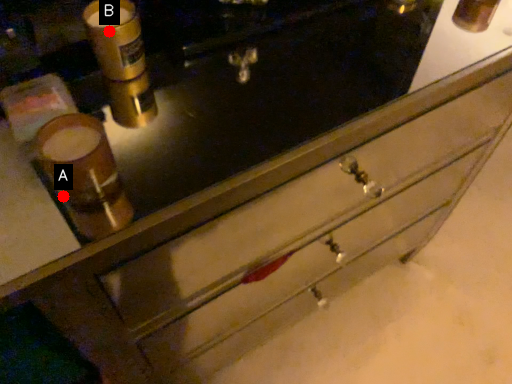
Question: Two points are circled on the image, labeled by A and B beside each circle. Which point is closer to the camera?

Choices:
 (A) A is closer
 (B) B is closer

Answer: (A)